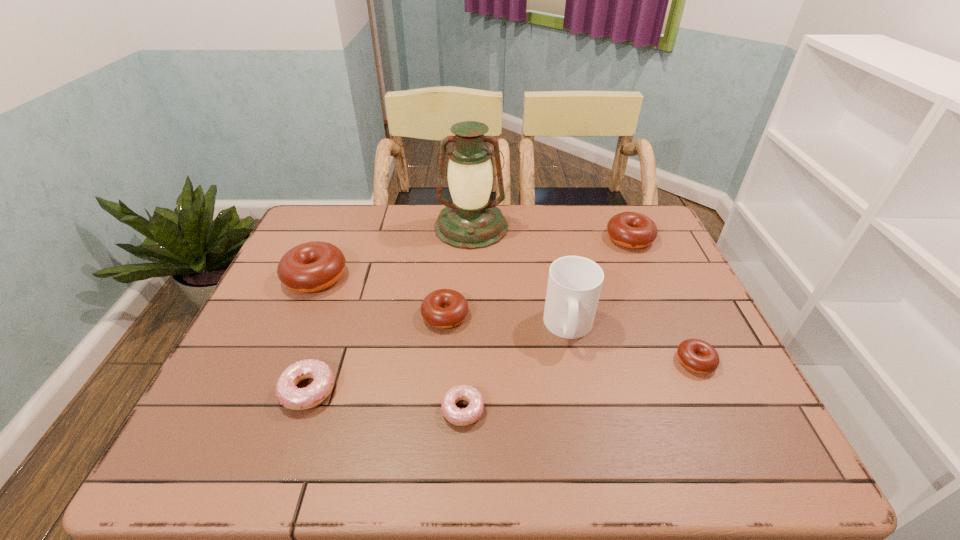
Locate an element on the screen. lantern at the far edge is located at coordinates (470, 221).

The image size is (960, 540). In order to click on doughnut that is at the far edge in this screenshot , I will do `click(634, 230)`.

Image resolution: width=960 pixels, height=540 pixels. I want to click on object located at the near edge, so click(x=469, y=415).

Locate an element on the screen. The height and width of the screenshot is (540, 960). object that is positioned at the far right corner is located at coordinates (634, 230).

The height and width of the screenshot is (540, 960). In order to click on vacant space at the far edge in this screenshot , I will do `click(399, 205)`.

Locate an element on the screen. vacant space at the near edge is located at coordinates (349, 458).

Image resolution: width=960 pixels, height=540 pixels. In the image, there is a desktop. Find the location of `vacant space at the left edge`. vacant space at the left edge is located at coordinates (252, 352).

I want to click on vacant space at the right edge, so click(x=727, y=358).

Identify the location of free space between the second biggest chocolate doughnut and the left pink doughnut. (468, 314).

Image resolution: width=960 pixels, height=540 pixels. In order to click on vacant area between the bigger pink doughnut and the farthest doughnut in this screenshot , I will do (468, 314).